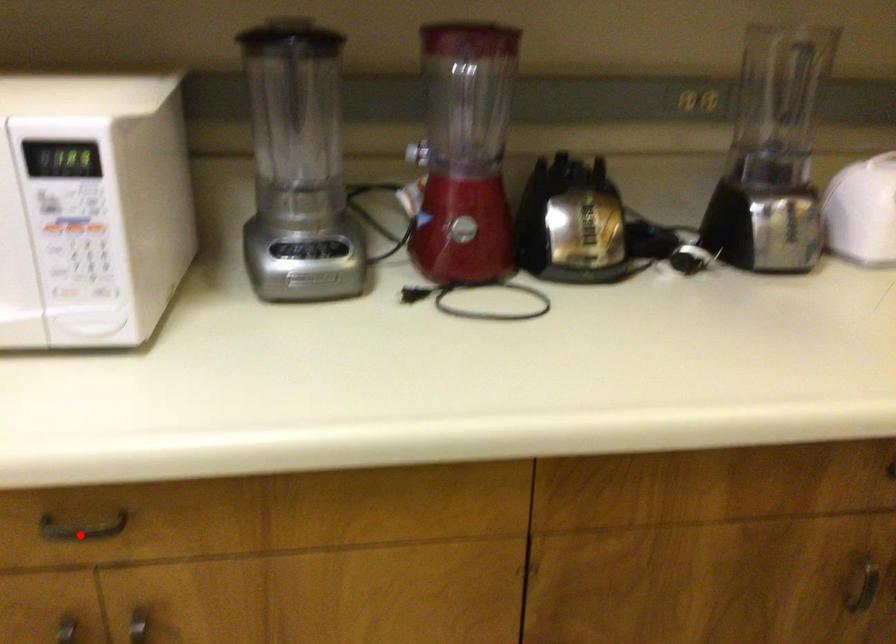
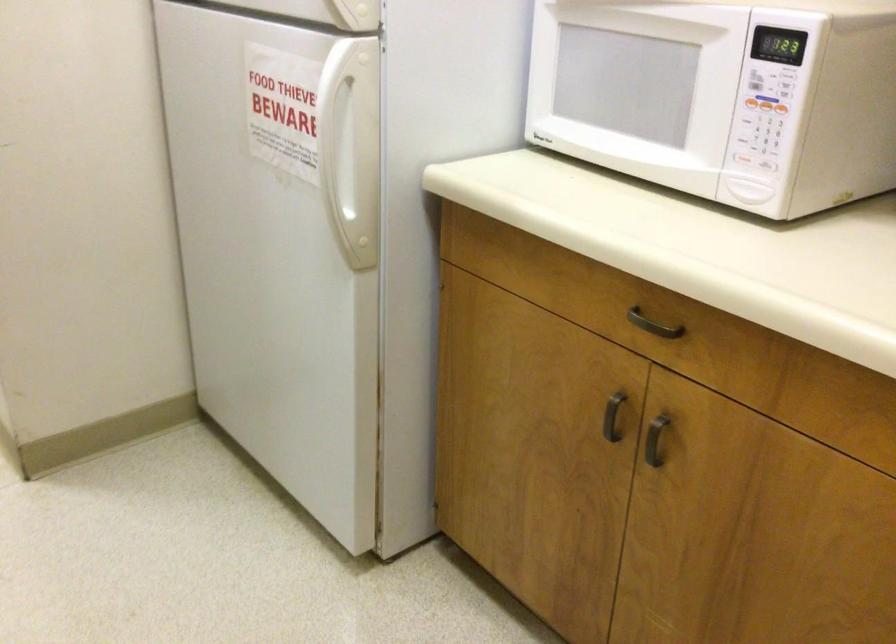
Question: I am providing you with two images of the same scene from different viewpoints. Image1 has a red point marked. In image2, the corresponding 3D location appears at what relative position? Reply with the corresponding letter.

Choices:
 (A) Closer
 (B) Farther

Answer: (B)